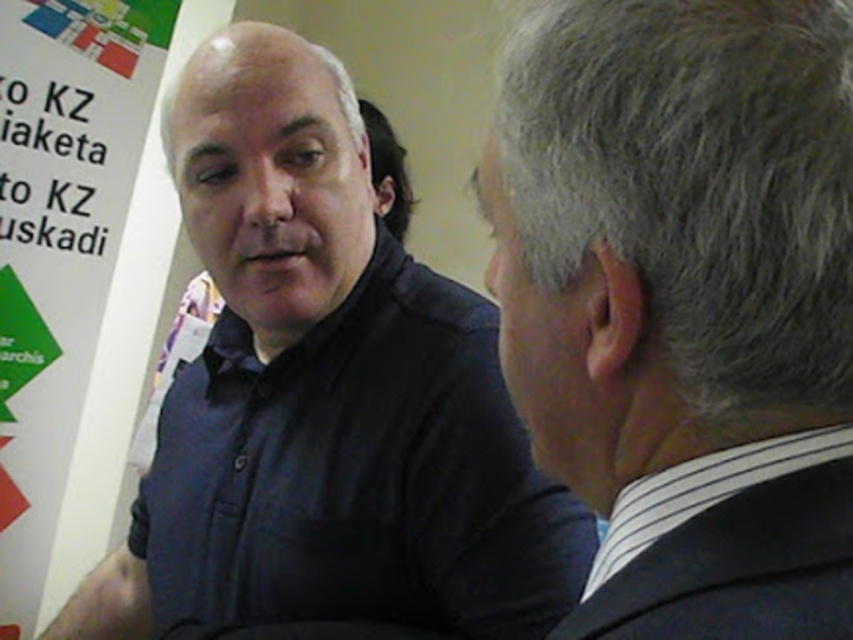
Question: Observing the image, what is the correct spatial positioning of matte black shirt at center in reference to white striped shirt at right?

Choices:
 (A) left
 (B) right

Answer: (A)

Question: Is matte black shirt at center to the right of white paper at left from the viewer's perspective?

Choices:
 (A) yes
 (B) no

Answer: (A)

Question: Which of these objects is positioned closest to the gray hair at upper right?

Choices:
 (A) white paper at left
 (B) white striped shirt at right
 (C) matte black shirt at center

Answer: (B)

Question: Is gray hair at upper right above white paper at left?

Choices:
 (A) no
 (B) yes

Answer: (A)

Question: Based on their relative distances, which object is nearer to the matte black shirt at center?

Choices:
 (A) white striped shirt at right
 (B) white paper at left

Answer: (A)

Question: Which object is positioned closest to the white paper at left?

Choices:
 (A) gray hair at upper right
 (B) matte black shirt at center

Answer: (B)